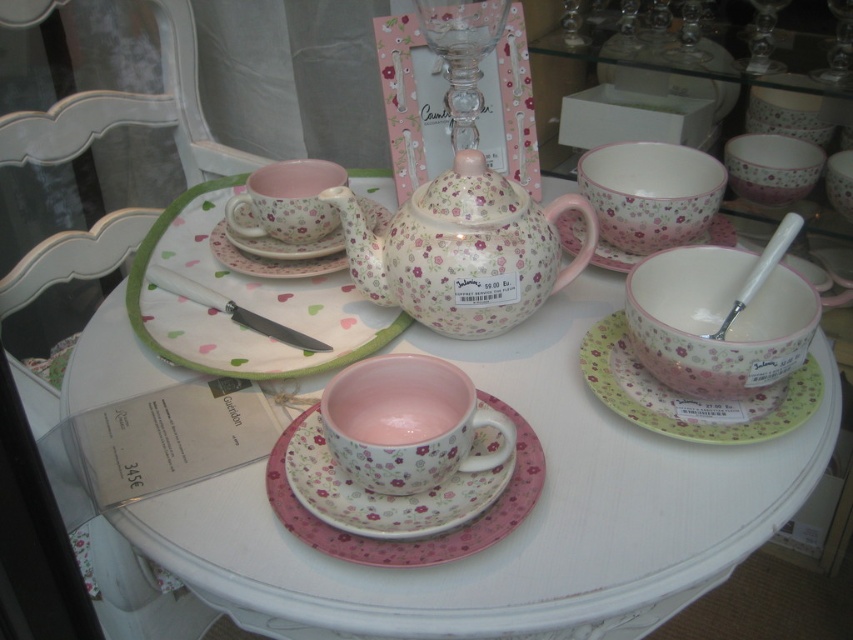
Question: Does pink glossy bowl at center appear on the left side of matte ceramic cup at center?

Choices:
 (A) yes
 (B) no

Answer: (B)

Question: Does floral porcelain teapot at center come behind pink ceramic saucer at center?

Choices:
 (A) yes
 (B) no

Answer: (B)

Question: Based on their relative distances, which object is farther from the floral porcelain teapot at center?

Choices:
 (A) pink floral porcelain teacup at center
 (B) pink fabric placemat at center
 (C) pink ceramic saucer at center

Answer: (C)

Question: Which object appears closest to the camera in this image?

Choices:
 (A) pink floral plate at right
 (B) matte pink porcelain teacup at center

Answer: (A)

Question: Among these points, which one is nearest to the camera?

Choices:
 (A) (115, 342)
 (B) (381, 316)

Answer: (A)

Question: Can you confirm if pink floral plate at right is thinner than pink matte saucer at center?

Choices:
 (A) yes
 (B) no

Answer: (A)